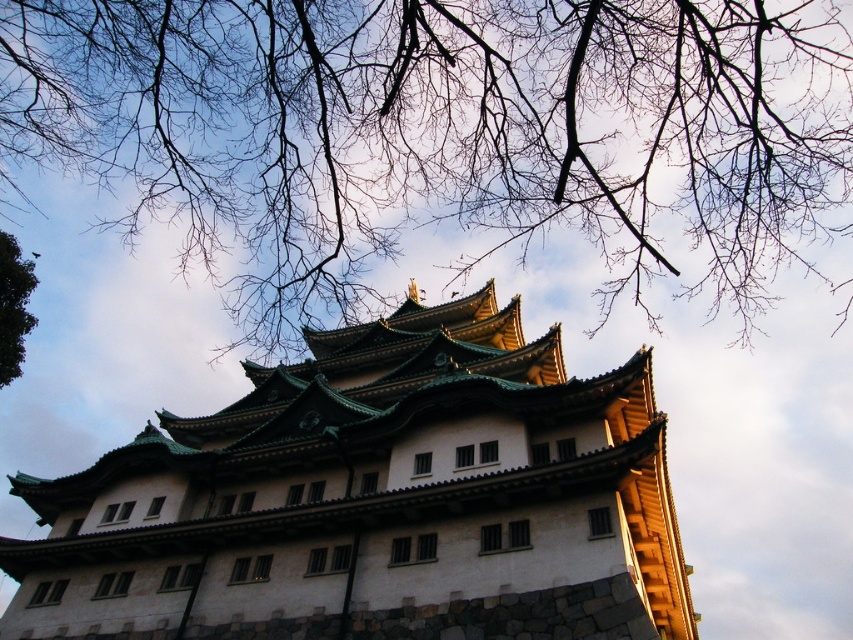
Question: Among these objects, which one is farthest from the camera?

Choices:
 (A) brown bark tree at upper center
 (B) white stone tower at center

Answer: (B)

Question: Is white stone tower at center further to the viewer compared to green leafy tree at upper left?

Choices:
 (A) no
 (B) yes

Answer: (A)

Question: Which of the following is the farthest from the observer?

Choices:
 (A) (321, 563)
 (B) (173, 33)
 (C) (9, 273)

Answer: (C)

Question: Which object appears closest to the camera in this image?

Choices:
 (A) brown bark tree at upper center
 (B) white stone tower at center
 (C) green leafy tree at upper left

Answer: (A)

Question: Can you confirm if brown bark tree at upper center is smaller than green leafy tree at upper left?

Choices:
 (A) no
 (B) yes

Answer: (A)

Question: Observing the image, what is the correct spatial positioning of white stone tower at center in reference to green leafy tree at upper left?

Choices:
 (A) below
 (B) above

Answer: (A)